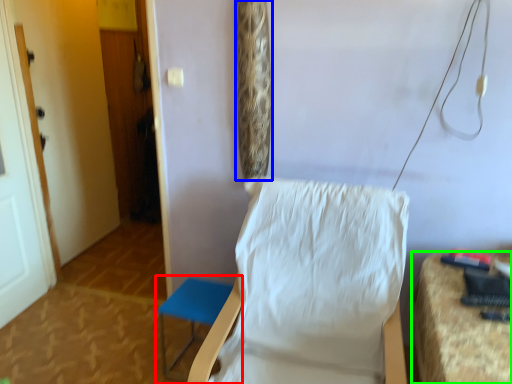
Question: Based on their relative distances, which object is nearer to furniture (highlighted by a red box)? Choose from curtain (highlighted by a blue box) and furniture (highlighted by a green box).

Choices:
 (A) curtain
 (B) furniture

Answer: (A)